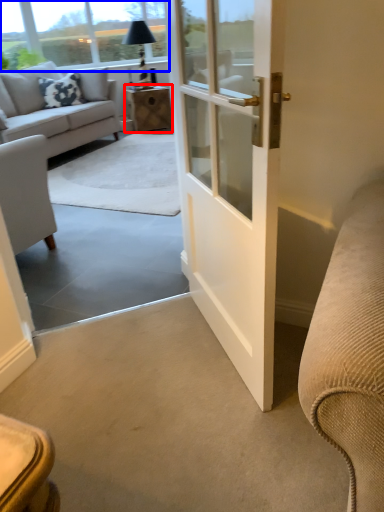
Question: Among these objects, which one is farthest to the camera, table (highlighted by a red box) or window screen (highlighted by a blue box)?

Choices:
 (A) table
 (B) window screen

Answer: (A)